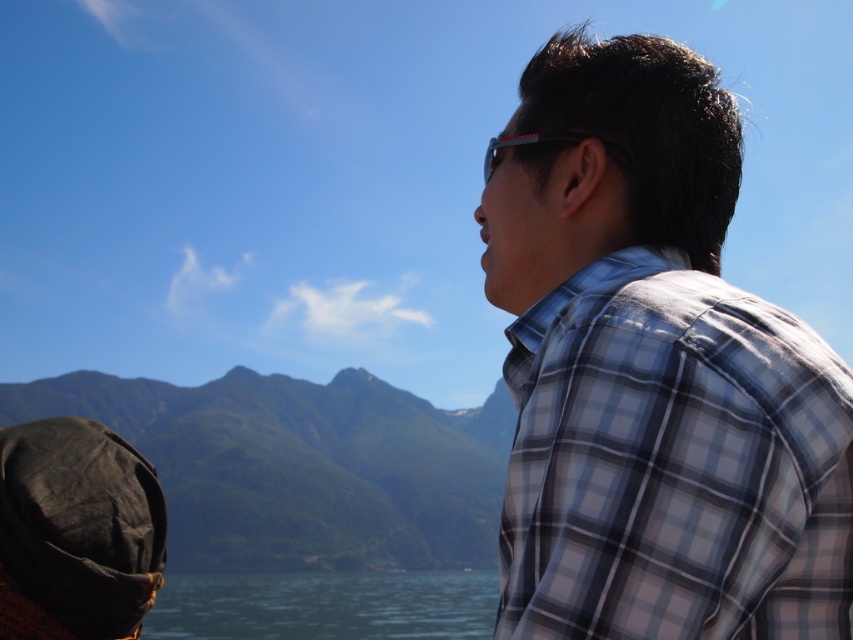
Question: Among these objects, which one is farthest from the camera?

Choices:
 (A) plaid fabric shirt at right
 (B) green matte mountain at left

Answer: (B)

Question: Which point is closer to the camera taking this photo?

Choices:
 (A) (628, 321)
 (B) (500, 138)
 (C) (264, 552)

Answer: (A)

Question: Does plaid fabric shirt at right appear on the left side of green matte mountain at left?

Choices:
 (A) yes
 (B) no

Answer: (B)

Question: Does plaid fabric shirt at right appear on the left side of green matte mountain at left?

Choices:
 (A) yes
 (B) no

Answer: (B)

Question: Can you confirm if green matte mountain at left is positioned to the left of blue water at lower center?

Choices:
 (A) no
 (B) yes

Answer: (B)

Question: Based on their relative distances, which object is farther from the green matte mountain at left?

Choices:
 (A) blue water at lower center
 (B) plaid fabric shirt at right

Answer: (B)